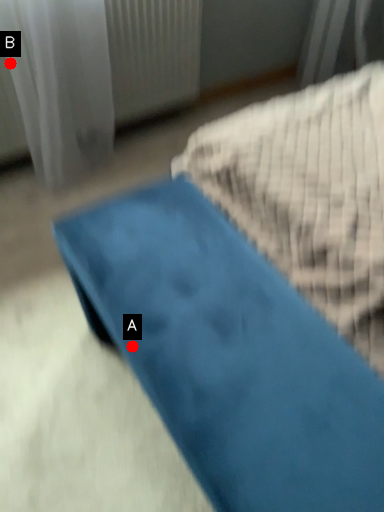
Question: Two points are circled on the image, labeled by A and B beside each circle. Among these points, which one is nearest to the camera?

Choices:
 (A) A is closer
 (B) B is closer

Answer: (A)